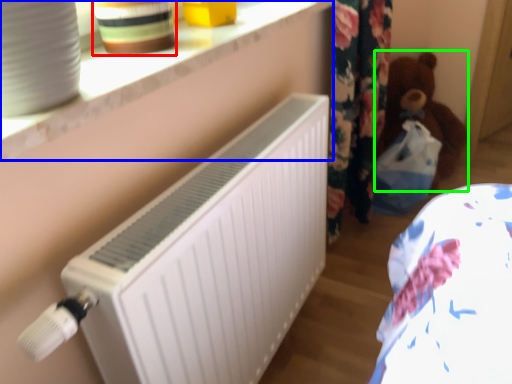
Question: Estimate the real-world distances between objects in this image. Which object is farther from pottery (highlighted by a red box), window sill (highlighted by a blue box) or teddy (highlighted by a green box)?

Choices:
 (A) window sill
 (B) teddy

Answer: (B)